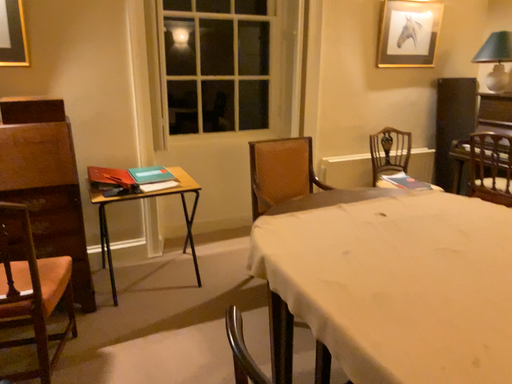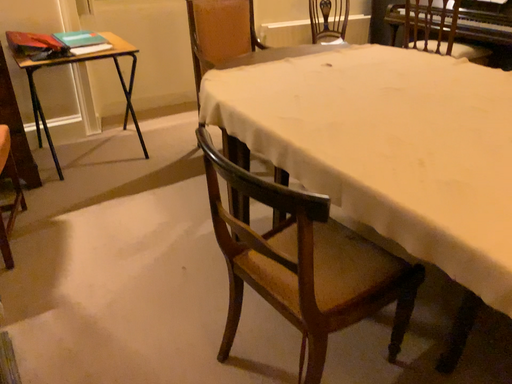
Question: Which way did the camera rotate in the video?

Choices:
 (A) rotated right
 (B) rotated left

Answer: (A)